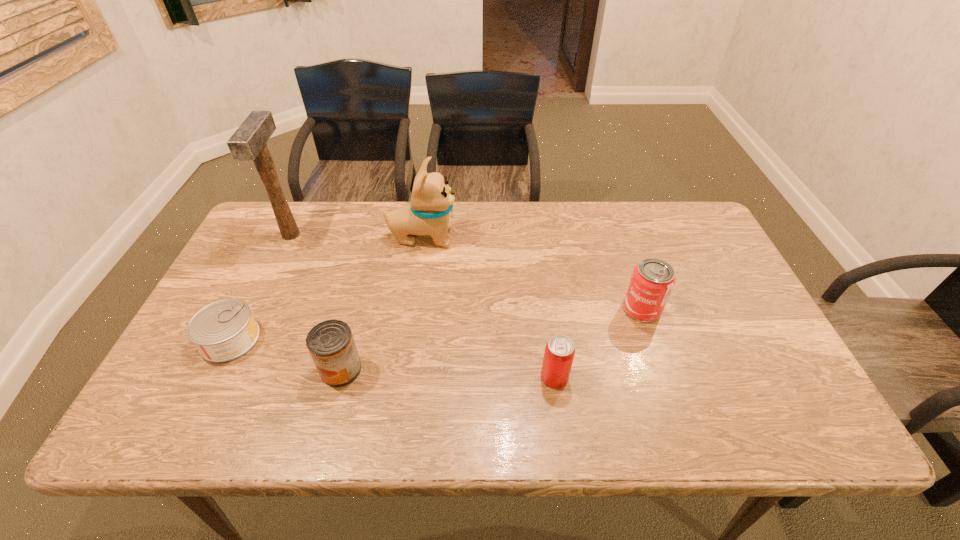
The image size is (960, 540). In order to click on vacant region located 0.050m on the left of the third can from right to left in this screenshot , I will do `click(300, 369)`.

Find the location of a particular element. free spot located 0.200m on the back of the fifth object from left to right is located at coordinates (544, 302).

Locate an element on the screen. This screenshot has width=960, height=540. free spot located 0.290m on the back of the leftmost can is located at coordinates pos(277,244).

What are the coordinates of `mallet positioned at the far edge` in the screenshot? It's located at (248, 143).

The width and height of the screenshot is (960, 540). In order to click on puppy present at the far edge in this screenshot , I will do `click(432, 199)`.

Where is `mallet that is at the left edge`? Image resolution: width=960 pixels, height=540 pixels. mallet that is at the left edge is located at coordinates (248, 143).

Locate an element on the screen. can at the left edge is located at coordinates (224, 330).

Find the location of a particular element. The height and width of the screenshot is (540, 960). object at the far left corner is located at coordinates (248, 143).

Identify the location of vacant point at the far edge. This screenshot has height=540, width=960. (456, 214).

You are a GUI agent. You are given a task and a screenshot of the screen. Output one action in this format:
    pyautogui.click(x=<x>, y=<y>)
    Task: Click on the free point at the near edge
    This screenshot has height=540, width=960.
    Given the screenshot: What is the action you would take?
    pyautogui.click(x=474, y=422)